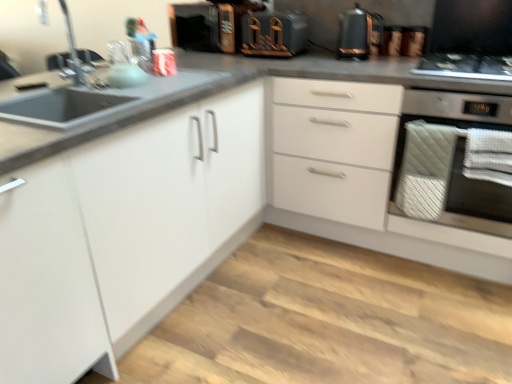
Question: Can you confirm if white quilted towel at right is shorter than white matte cabinet at center?

Choices:
 (A) yes
 (B) no

Answer: (A)

Question: Is white quilted towel at right positioned behind white matte cabinet at center?

Choices:
 (A) no
 (B) yes

Answer: (B)

Question: Does white quilted towel at right touch white matte cabinet at center?

Choices:
 (A) no
 (B) yes

Answer: (A)

Question: Is white quilted towel at right positioned before white matte cabinet at center?

Choices:
 (A) yes
 (B) no

Answer: (B)

Question: From a real-world perspective, is white quilted towel at right located beneath white matte cabinet at center?

Choices:
 (A) no
 (B) yes

Answer: (A)

Question: Would you say black glass gas stove at upper right is inside or outside wooden toaster at upper center?

Choices:
 (A) inside
 (B) outside

Answer: (B)

Question: From the image's perspective, is black glass gas stove at upper right above or below wooden toaster at upper center?

Choices:
 (A) above
 (B) below

Answer: (B)

Question: Considering the positions of black glass gas stove at upper right and wooden toaster at upper center in the image, is black glass gas stove at upper right wider or thinner than wooden toaster at upper center?

Choices:
 (A) thin
 (B) wide

Answer: (B)

Question: Does point (502, 59) appear closer or farther from the camera than point (305, 43)?

Choices:
 (A) closer
 (B) farther

Answer: (A)

Question: Is metallic copper kettle at upper right bigger or smaller than matte silver faucet at upper left?

Choices:
 (A) big
 (B) small

Answer: (A)

Question: Is metallic copper kettle at upper right to the left or to the right of matte silver faucet at upper left in the image?

Choices:
 (A) left
 (B) right

Answer: (B)

Question: In terms of height, does metallic copper kettle at upper right look taller or shorter compared to matte silver faucet at upper left?

Choices:
 (A) tall
 (B) short

Answer: (B)

Question: From a real-world perspective, is metallic copper kettle at upper right above or below matte silver faucet at upper left?

Choices:
 (A) below
 (B) above

Answer: (A)

Question: Do you think metallic copper kettle at upper right is within wooden toaster at upper center, or outside of it?

Choices:
 (A) outside
 (B) inside

Answer: (A)

Question: From the image's perspective, is metallic copper kettle at upper right above or below wooden toaster at upper center?

Choices:
 (A) below
 (B) above

Answer: (A)